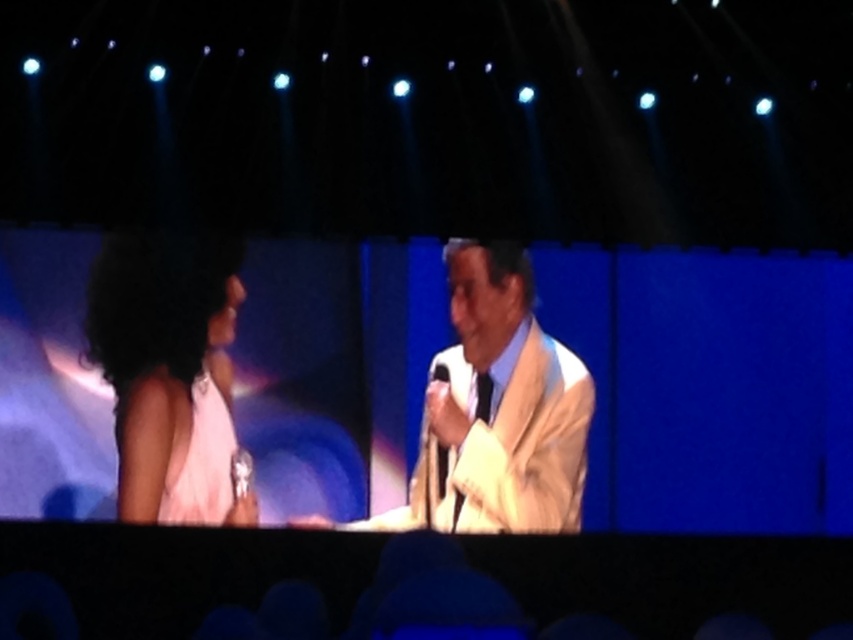
In the stage performance scene, there is a light beige suit at center and a pink satin dress at left. Which object is positioned to the right of the other?

The light beige suit at center is to the right of the pink satin dress at left.

You are sitting on the stage and want to reach both the point at coordinates (x=444, y=506) and the point at (x=163, y=500). Which point will you reach first if you move forward?

You will reach the point at coordinates (x=444, y=506) first because it is closer to you than the point at (x=163, y=500), which is further away.

You are a photographer taking a picture of the stage. You need to focus on the light beige suit at center and the matte white dress at left. Based on their positions, which one is higher in the frame?

The light beige suit at center is higher in the frame than the matte white dress at left because it is located above it.